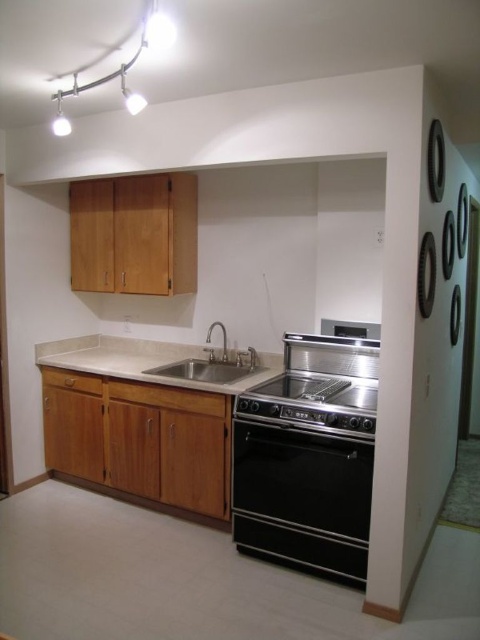
Question: Does black stainless steel oven at center appear on the right side of silver metallic faucet at center?

Choices:
 (A) no
 (B) yes

Answer: (B)

Question: Among these objects, which one is nearest to the camera?

Choices:
 (A) beige granite countertop at center
 (B) silver metallic faucet at center

Answer: (A)

Question: Does black stainless steel oven at center have a larger size compared to beige granite countertop at center?

Choices:
 (A) no
 (B) yes

Answer: (A)

Question: Can you confirm if black stainless steel oven at center is wider than stainless steel oven at center?

Choices:
 (A) no
 (B) yes

Answer: (A)

Question: Which of these objects is positioned farthest from the black stainless steel oven at center?

Choices:
 (A) beige granite countertop at center
 (B) satin steel sink at center
 (C) silver metallic faucet at center
 (D) stainless steel oven at center

Answer: (C)

Question: Which point is closer to the camera?

Choices:
 (A) beige granite countertop at center
 (B) stainless steel oven at center
 (C) silver metallic faucet at center

Answer: (B)